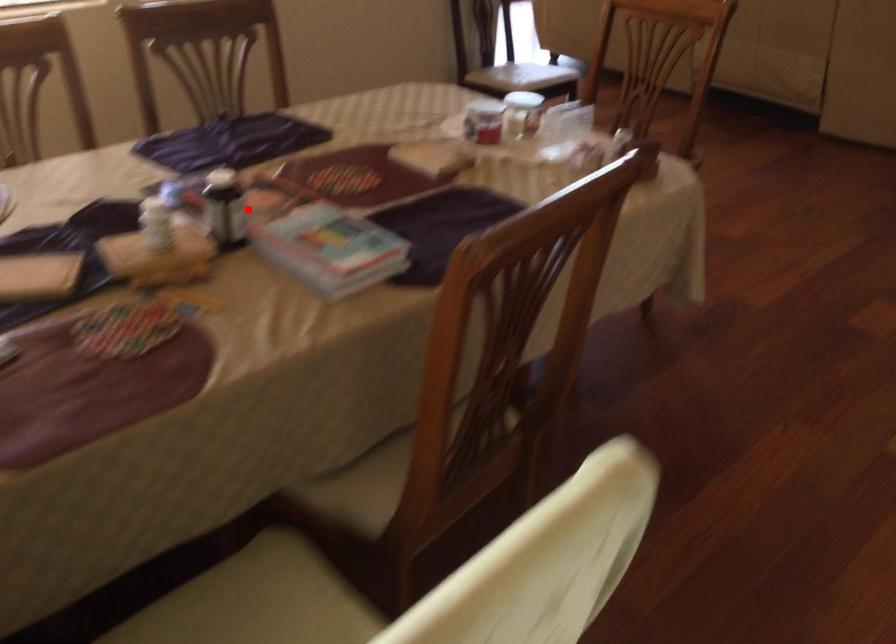
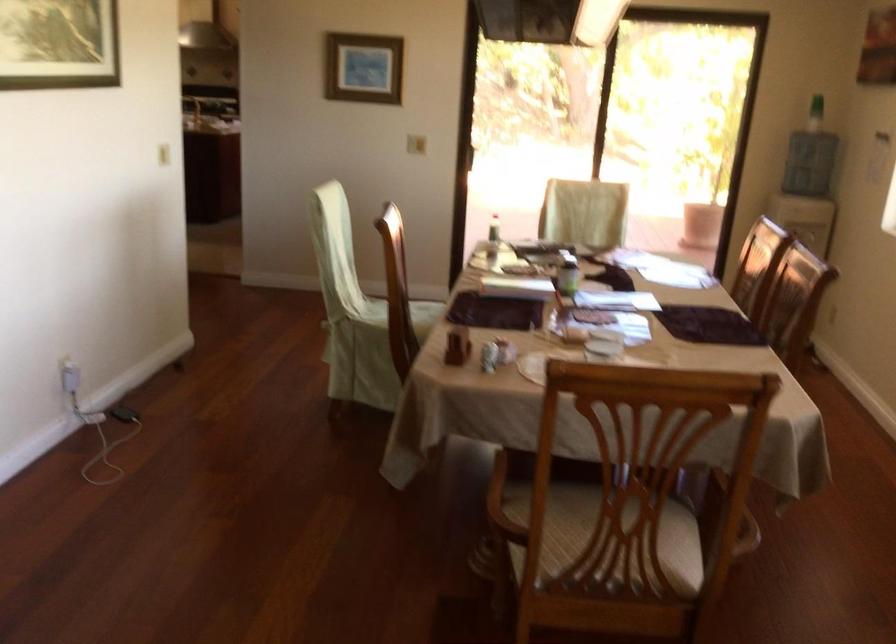
Question: I am providing you with two images of the same scene from different viewpoints. In image1, a red point is highlighted. Considering the same 3D point in image2, which of the following is correct?

Choices:
 (A) It is closer
 (B) It is farther

Answer: (B)